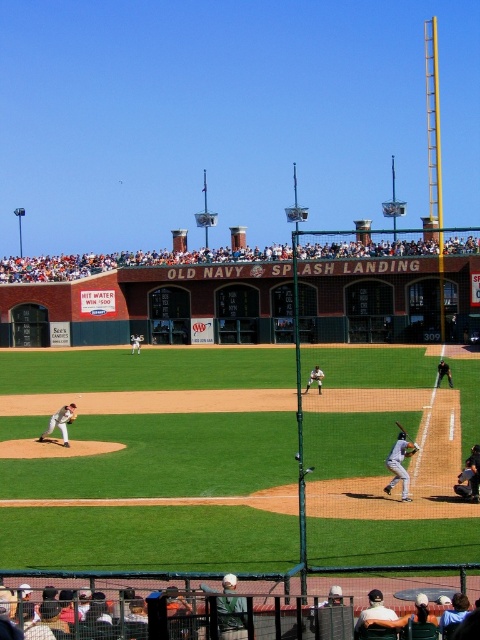
Question: Is matte gray uniform at center smaller than green jersey baseball player at center?

Choices:
 (A) no
 (B) yes

Answer: (B)

Question: Can you confirm if gray uniform bat at right is thinner than green jersey baseball player at center?

Choices:
 (A) no
 (B) yes

Answer: (A)

Question: Which object is closer to the camera taking this photo?

Choices:
 (A) white baseball glove at center
 (B) wooden baseball bat at lower center

Answer: (B)

Question: Which point is farther from the camera taking this photo?

Choices:
 (A) (387, 246)
 (B) (136, 348)
 (C) (48, 424)
 (D) (445, 376)

Answer: (A)

Question: Is orange fabric crowd at upper center wider than white baseball glove at center?

Choices:
 (A) yes
 (B) no

Answer: (A)

Question: Which object is farther from the camera taking this photo?

Choices:
 (A) green jersey baseball player at center
 (B) orange fabric crowd at upper center

Answer: (A)